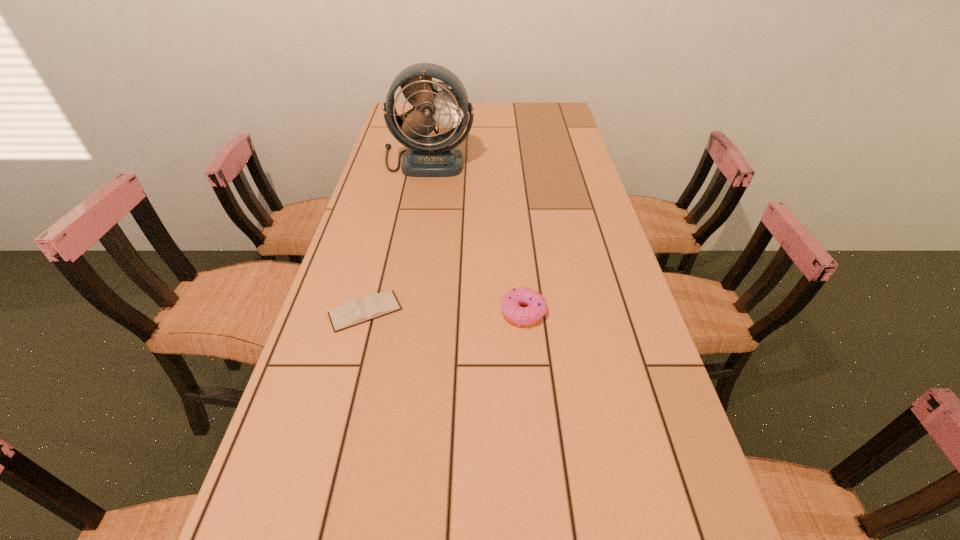
I want to click on blank space located 0.330m on the back of the shortest object, so click(391, 214).

Locate an element on the screen. The image size is (960, 540). object that is positioned at the far edge is located at coordinates (442, 83).

The image size is (960, 540). I want to click on fan positioned at the left edge, so click(427, 156).

This screenshot has height=540, width=960. Identify the location of can present at the left edge. [442, 83].

Locate an element on the screen. This screenshot has width=960, height=540. diary at the left edge is located at coordinates (372, 306).

This screenshot has height=540, width=960. I want to click on object located in the far left corner section of the desktop, so click(x=442, y=83).

Where is `vacant area at the far edge`? The width and height of the screenshot is (960, 540). vacant area at the far edge is located at coordinates (492, 110).

Where is `vacant space at the left edge of the desktop`? The height and width of the screenshot is (540, 960). vacant space at the left edge of the desktop is located at coordinates (345, 302).

Where is `blank space at the right edge of the desktop`? The image size is (960, 540). blank space at the right edge of the desktop is located at coordinates (581, 191).

Where is `free space between the tallest object and the third tallest object`? free space between the tallest object and the third tallest object is located at coordinates (475, 237).